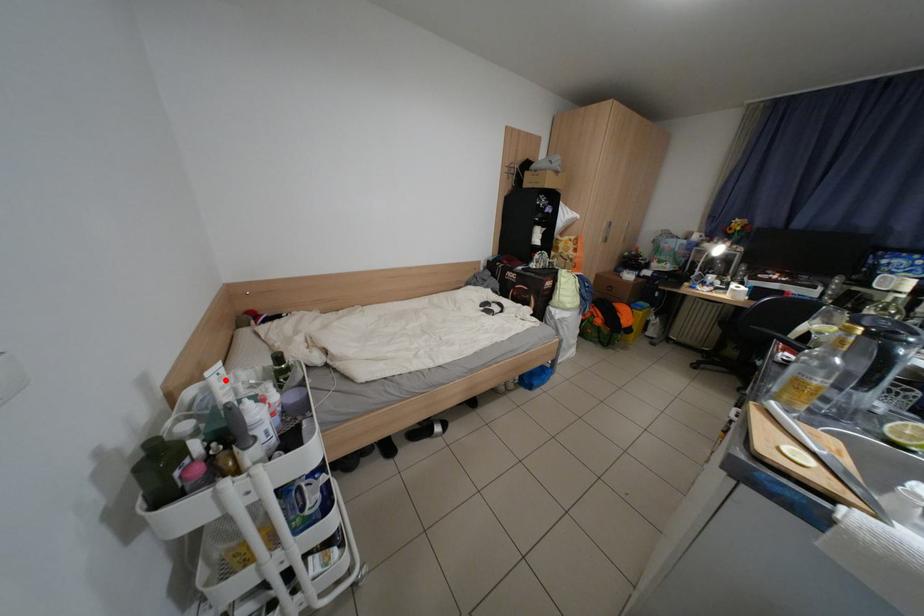
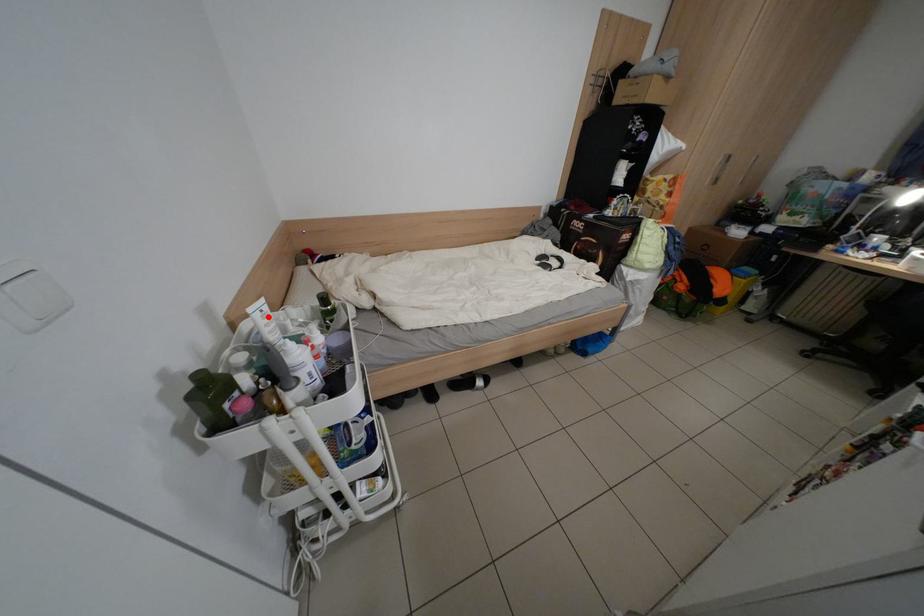
I am providing you with two images of the same scene from different viewpoints. A red point is marked on the first image and another point is marked on the second image. Does the point marked in image1 correspond to the same location as the one in image2?

Yes